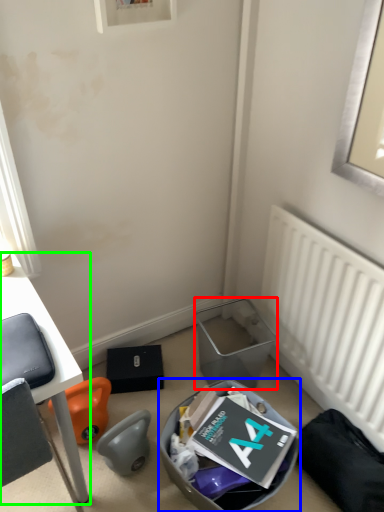
Question: Estimate the real-world distances between objects in this image. Which object is closer to trash bin/can (highlighted by a red box), trash bin/can (highlighted by a blue box) or desk (highlighted by a green box)?

Choices:
 (A) trash bin/can
 (B) desk

Answer: (A)